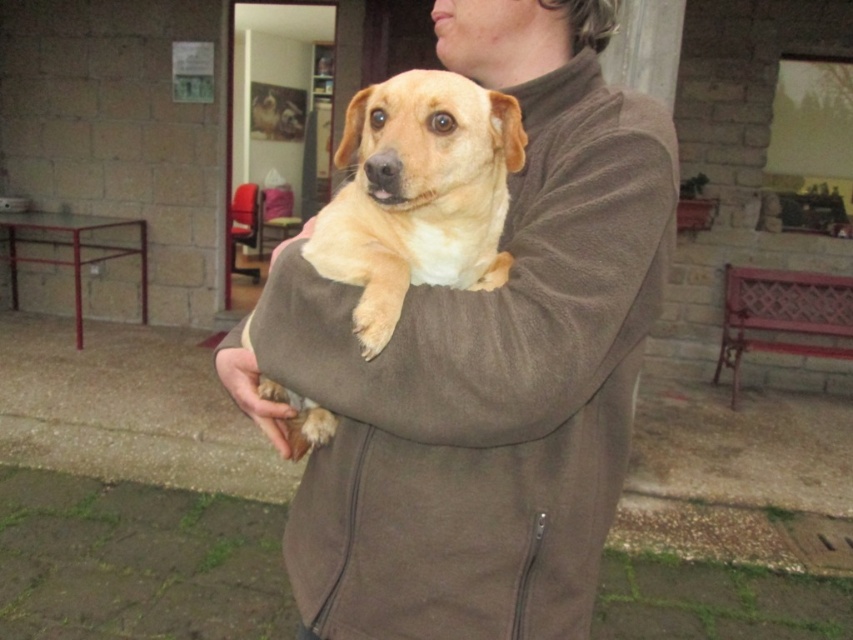
Is point (477, 556) more distant than point (329, 429)?

No.

Is point (508, 292) behind point (456, 131)?

That is True.

The width and height of the screenshot is (853, 640). What are the coordinates of `matte brown jacket at center` in the screenshot? It's located at (482, 365).